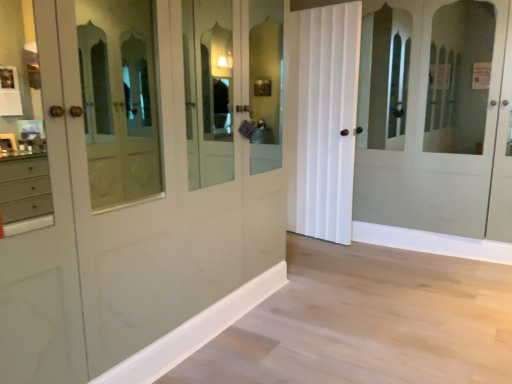
Identify the location of free space above white wood molding at lower center (from a real-world perspective). pos(211,306).